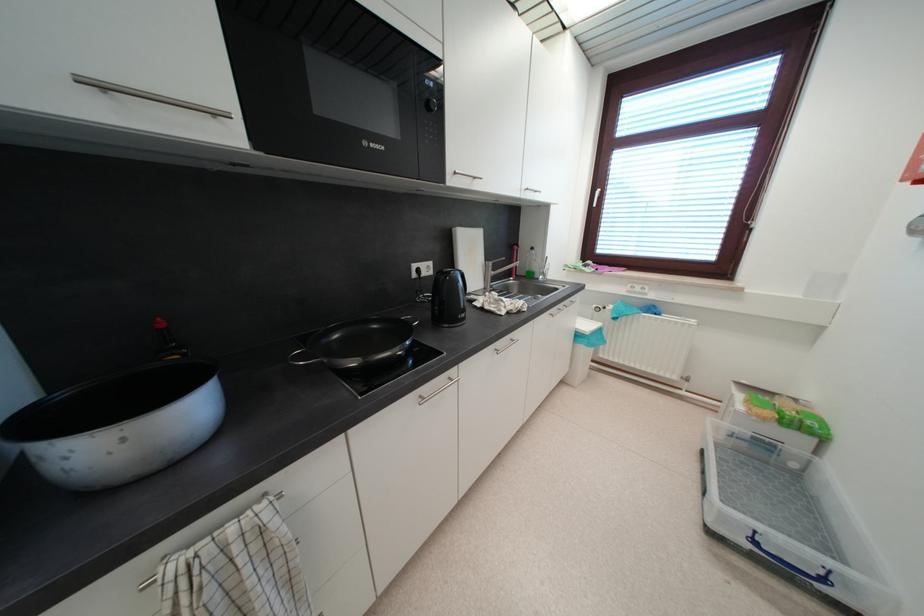
Find the location of `blue storage box handle`. blue storage box handle is located at coordinates (789, 565).